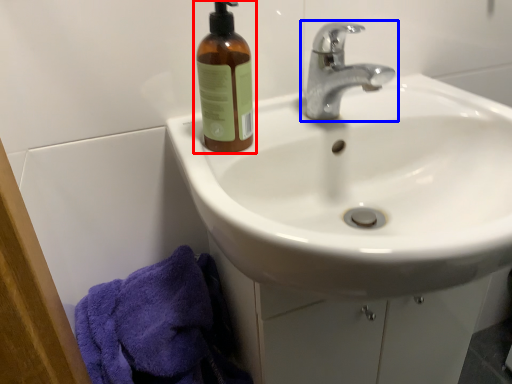
Question: Among these objects, which one is nearest to the camera, bottle (highlighted by a red box) or tap (highlighted by a blue box)?

Choices:
 (A) bottle
 (B) tap

Answer: (B)